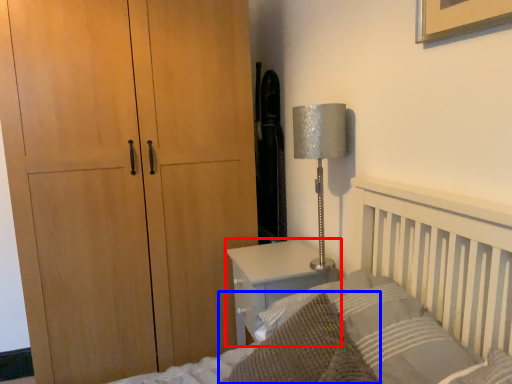
Question: Which object appears closest to the camera in this image, nightstand (highlighted by a red box) or throw pillow (highlighted by a blue box)?

Choices:
 (A) nightstand
 (B) throw pillow

Answer: (B)